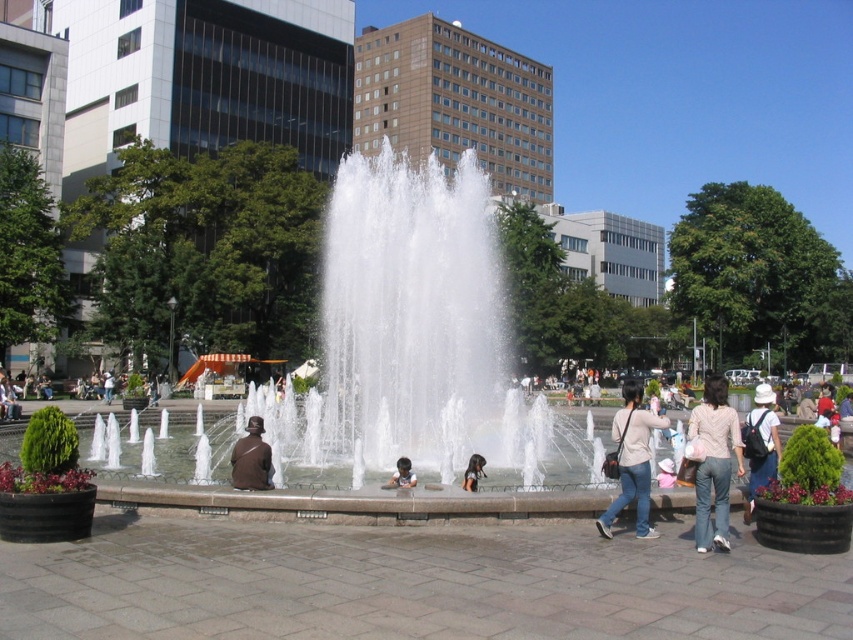
You are a photographer standing at the edge of the fountain. You want to capture a photo of the light pink cotton shirt at right and smooth brown hair at center in the same frame. Given that your camera has a maximum focus range of 4 meters, will both subjects be in focus?

The light pink cotton shirt at right and smooth brown hair at center are 4.34 meters apart, which exceeds the camera maximum focus range of 4 meters. Therefore, both subjects cannot be in focus at the same time.

You are standing at the edge of the clear water fountain at center and want to throw a small ball to a friend holding a white fabric hat at center. If the ball travels in a straight line, will it pass over the water jets of the fountain?

The clear water fountain at center is 46.12 meters away from the white fabric hat at center. Since the fountain has water jets shooting upwards and outwards, the ball traveling in a straight line would pass over the water jets of the fountain as it moves from the fountain to the hat.